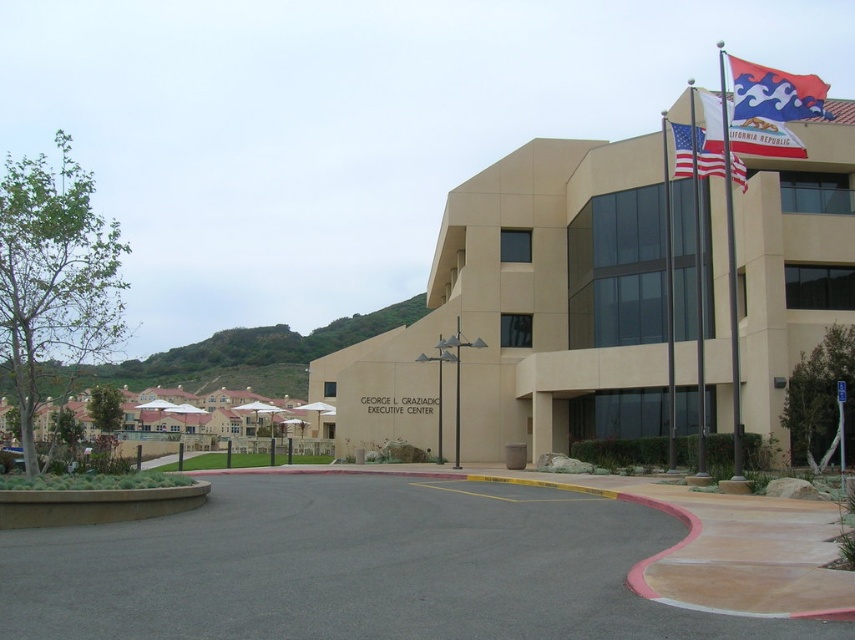
You are a delivery driver arriving at the George L. Graziadio Executive Center. You need to park your truck, which is 60 feet long, in the parking area between the white flagpole at upper right and a camera. Is there enough space for your truck?

The distance between the white flagpole at upper right and the camera is 58.22 feet, which is shorter than the truck length of 60 feet. Therefore, there is not enough space to park the truck between them.